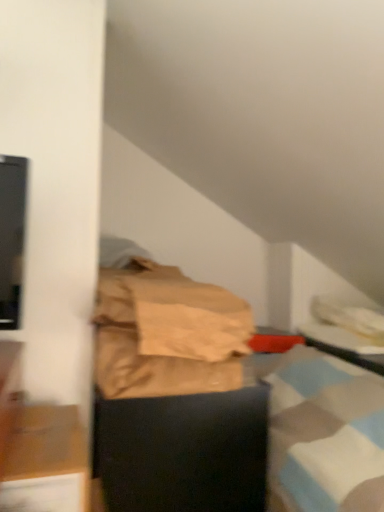
The width and height of the screenshot is (384, 512). I want to click on free space below brown paper bag at center (from a real-world perspective), so click(x=181, y=392).